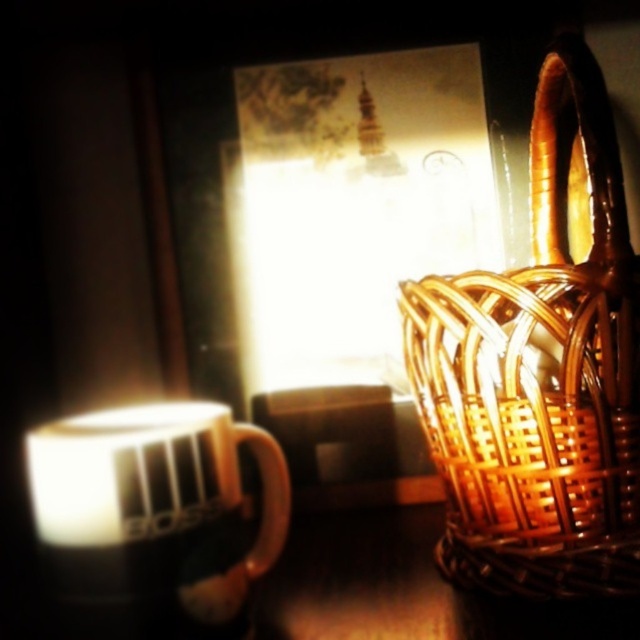
Does brown woven basket at right have a greater width compared to white glossy mug at left?

No, brown woven basket at right is not wider than white glossy mug at left.

Does brown woven basket at right come in front of white glossy mug at left?

No, it is not.

Is point (563, 58) positioned behind point (212, 515)?

Yes.

Identify the location of brown woven basket at right. This screenshot has height=640, width=640. (540, 372).